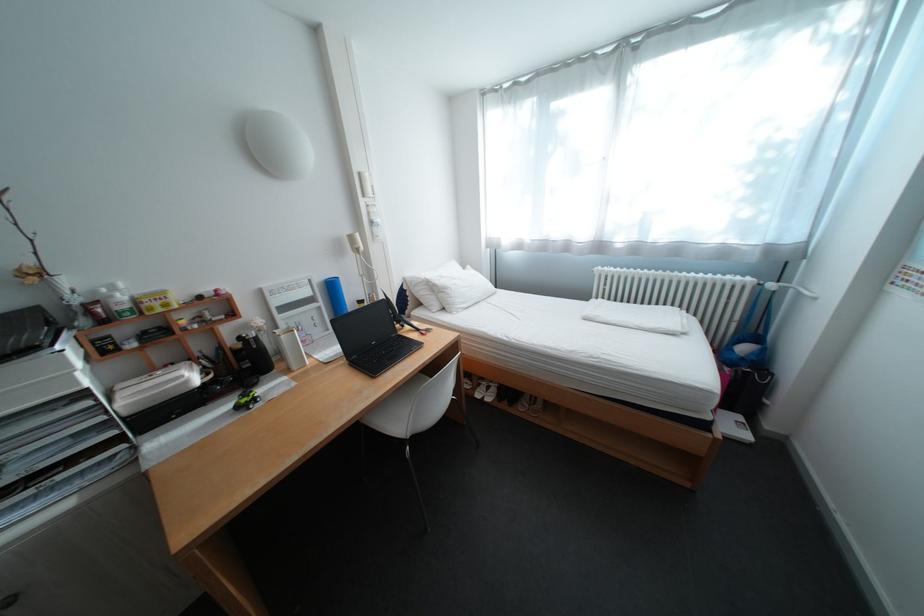
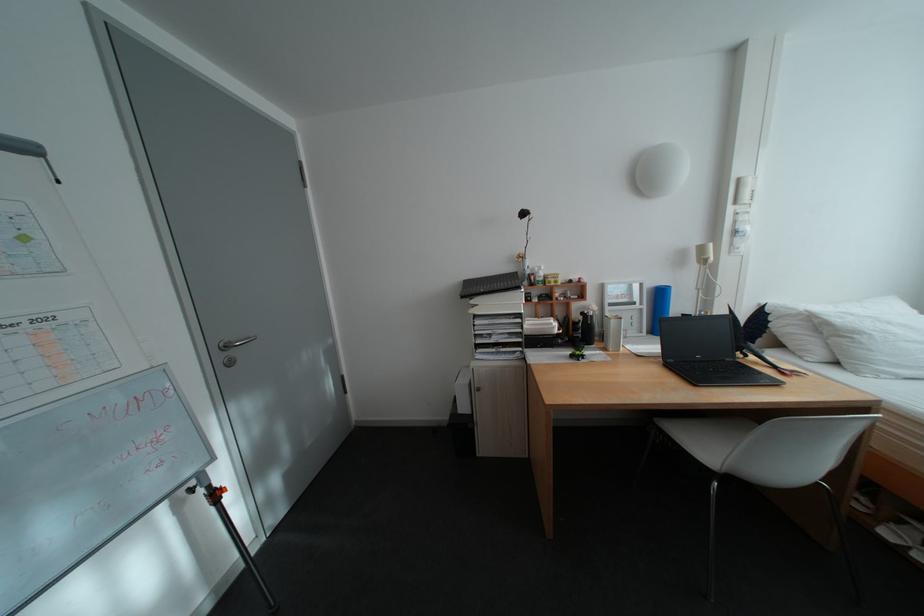
The point at (x=411, y=445) is marked in the first image. Where is the corresponding point in the second image?

(718, 472)